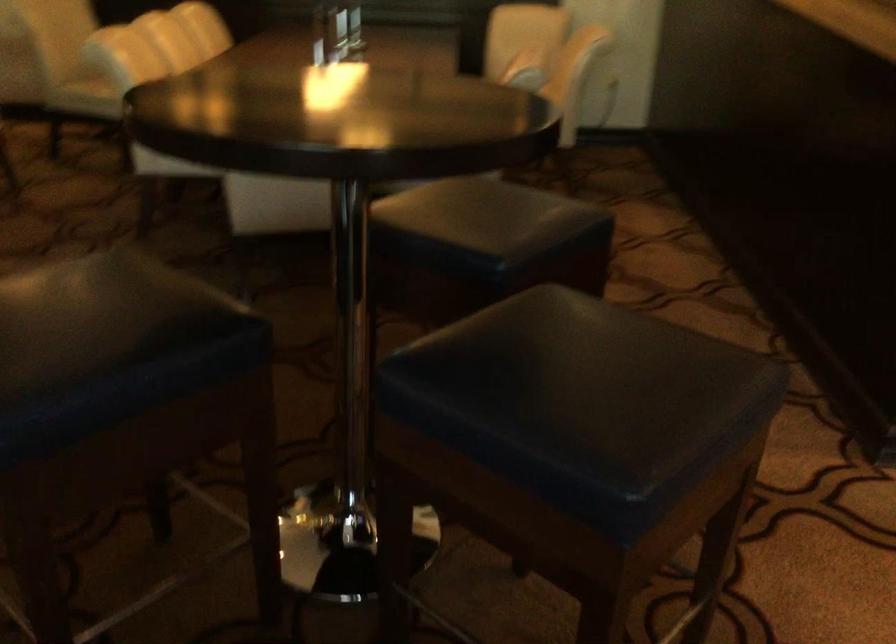
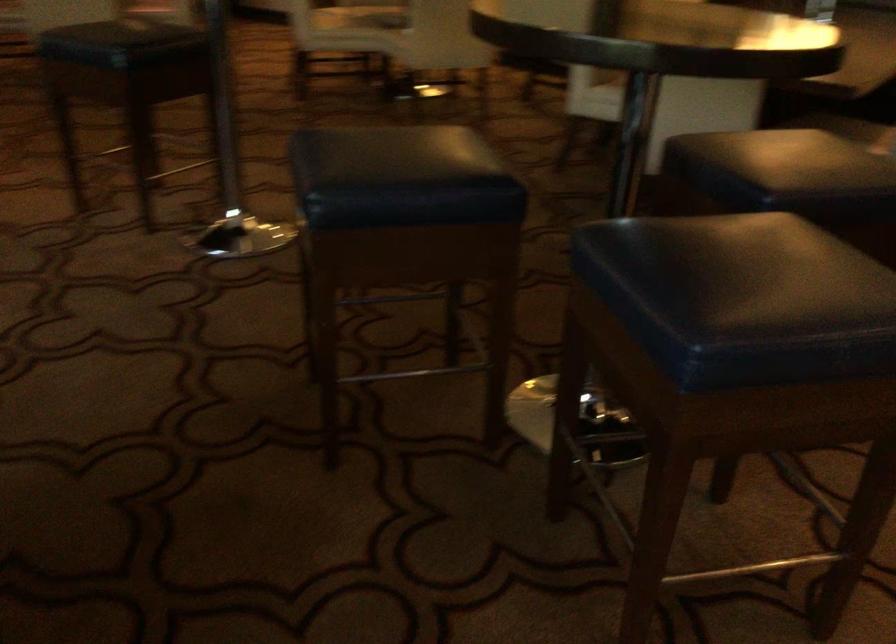
Question: The images are taken continuously from a first-person perspective. In which direction is your viewpoint rotating?

Choices:
 (A) Left
 (B) Right
 (C) Up
 (D) Down

Answer: (A)